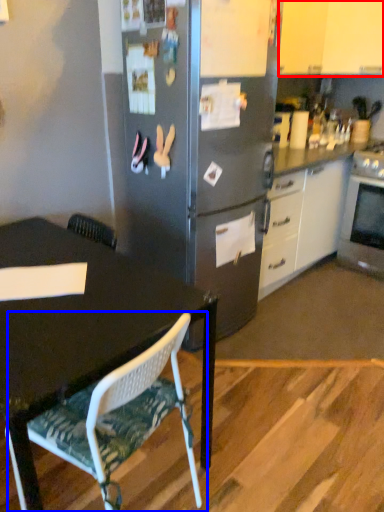
Question: Which of the following is the closest to the observer, cabinetry (highlighted by a red box) or chair (highlighted by a blue box)?

Choices:
 (A) cabinetry
 (B) chair

Answer: (B)